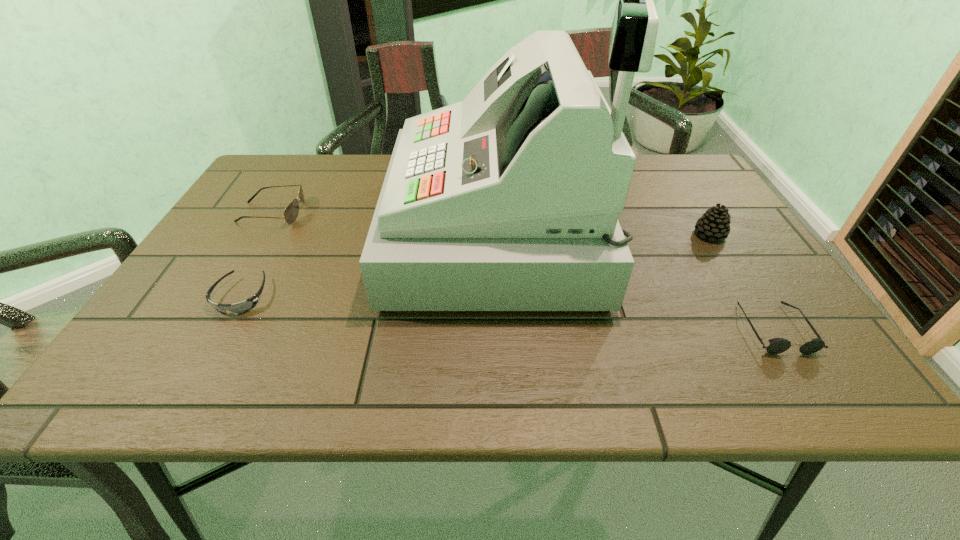
Locate an element on the screen. free space located 0.230m on the keypad side of the cash register is located at coordinates (299, 234).

The image size is (960, 540). Find the location of `free location located 0.260m at the narrow end of the fourth shortest object`. free location located 0.260m at the narrow end of the fourth shortest object is located at coordinates (588, 234).

In order to click on free space located 0.080m at the narrow end of the fourth shortest object in this screenshot , I will do `click(661, 234)`.

I want to click on vacant space located 0.350m at the narrow end of the fourth shortest object, so click(x=552, y=234).

At what (x,y) coordinates should I click in order to perform the action: click on vacant space located on the front-facing side of the third tallest object. Please return your answer as a coordinate pair (x, y). Looking at the image, I should click on (353, 213).

In order to click on vacant region located 0.050m on the front-facing side of the rightmost sunglasses in this screenshot , I will do `click(805, 378)`.

Locate an element on the screen. The height and width of the screenshot is (540, 960). free point located 0.150m on the lenses of the shortest object is located at coordinates (195, 380).

The width and height of the screenshot is (960, 540). In order to click on object situated at the far edge in this screenshot , I will do `click(509, 200)`.

This screenshot has width=960, height=540. Identify the location of pinecone located at the right edge. (714, 224).

Where is `sunglasses at the right edge`? sunglasses at the right edge is located at coordinates (777, 345).